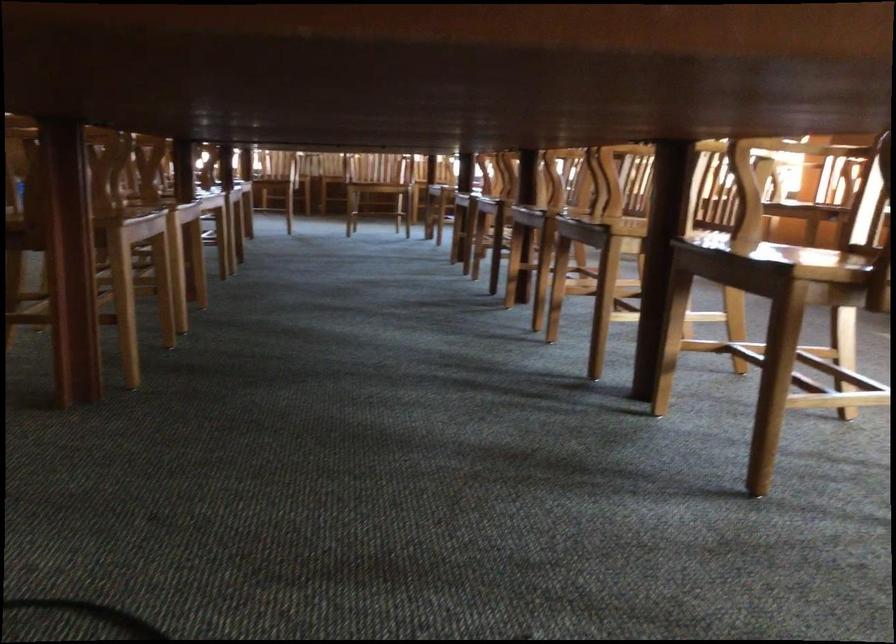
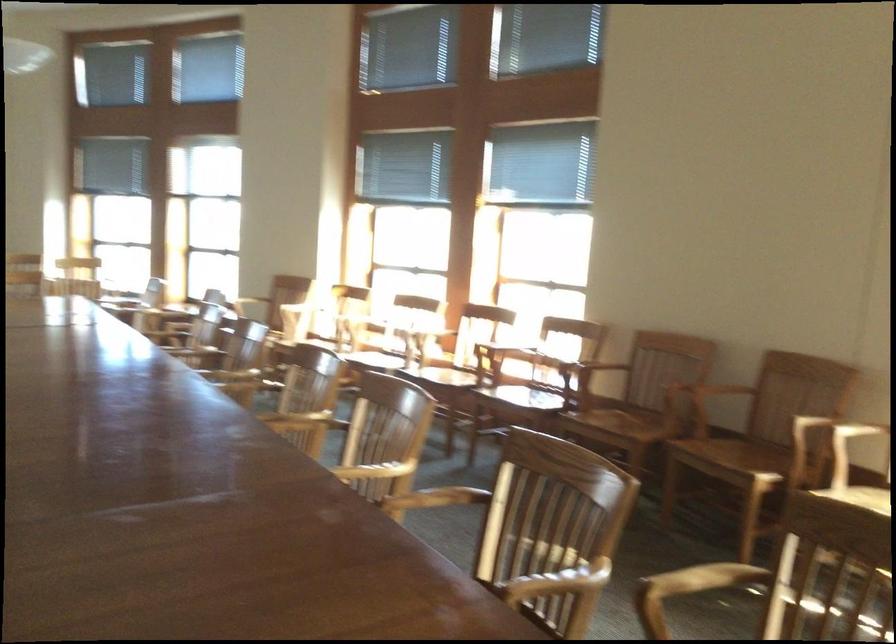
Question: The camera is either moving clockwise (left) or counter-clockwise (right) around the object. The first image is from the beginning of the video and the second image is from the end. Is the camera moving left or right when shooting the video?

Choices:
 (A) Left
 (B) Right

Answer: (A)